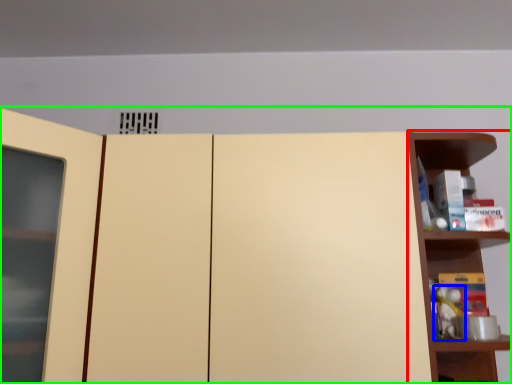
Question: Based on their relative distances, which object is farther from shelf (highlighted by a red box)? Choose from toy (highlighted by a blue box) and cupboard (highlighted by a green box).

Choices:
 (A) toy
 (B) cupboard

Answer: (B)